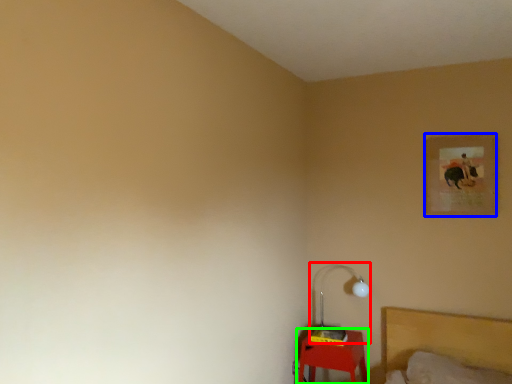
Question: Estimate the real-world distances between objects in this image. Which object is farther from lamp (highlighted by a red box), picture frame (highlighted by a blue box) or furniture (highlighted by a green box)?

Choices:
 (A) picture frame
 (B) furniture

Answer: (A)